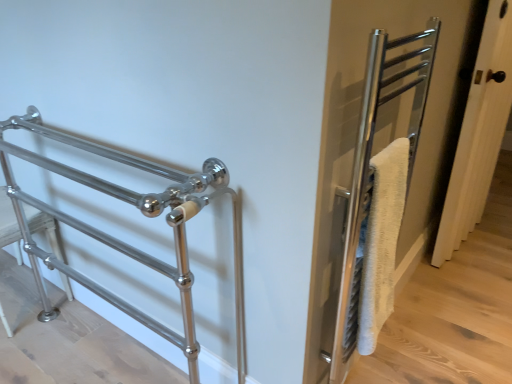
You are a GUI agent. You are given a task and a screenshot of the screen. Output one action in this format:
    pyautogui.click(x=<x>, y=<y>)
    Task: Click on the free space in front of white wood door at right
    The height and width of the screenshot is (384, 512).
    Given the screenshot: What is the action you would take?
    pyautogui.click(x=471, y=279)